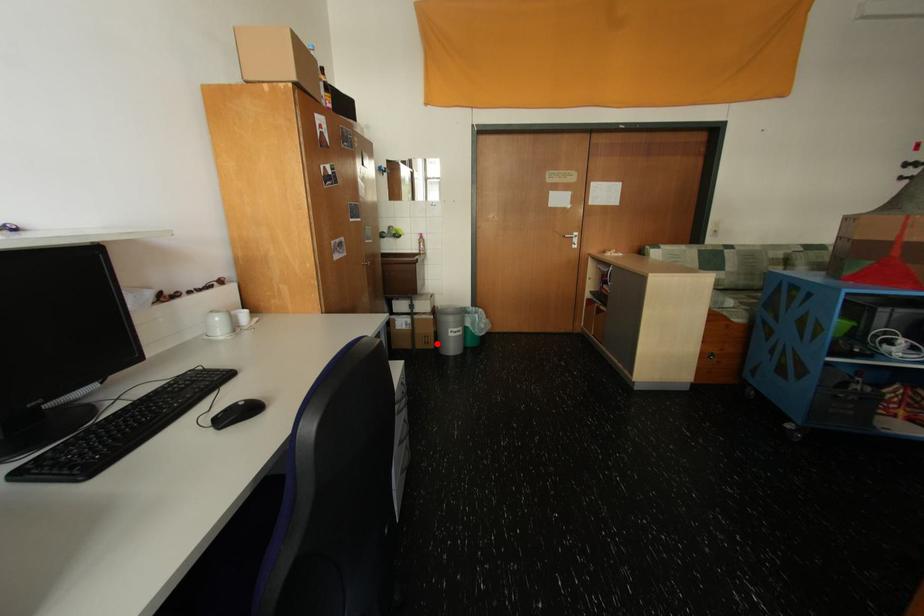
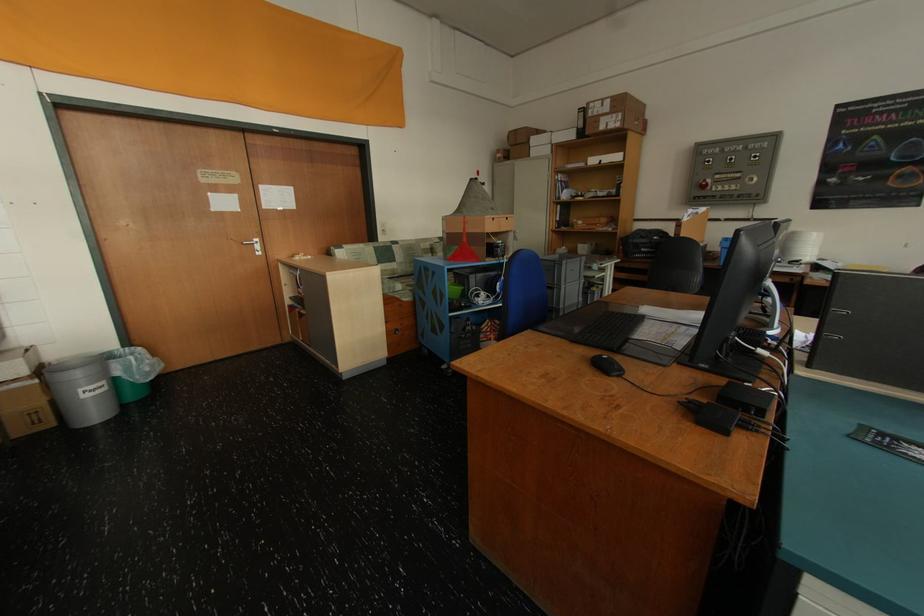
Question: I am providing you with two images of the same scene from different viewpoints. A red point is marked on the first image. Is the red point's position out of view in image 2?

Choices:
 (A) Yes
 (B) No

Answer: (B)